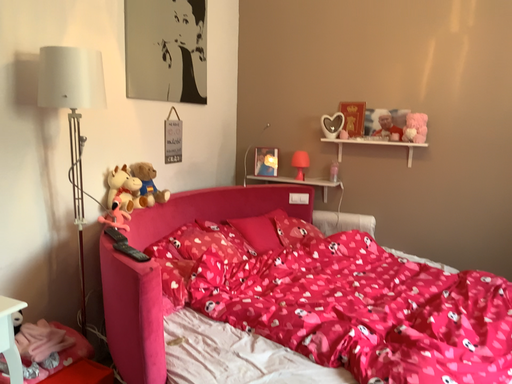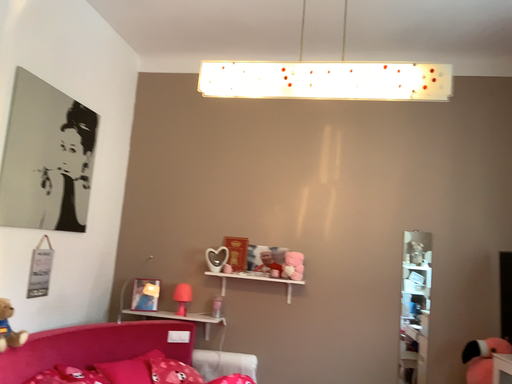
Question: How did the camera likely rotate when shooting the video?

Choices:
 (A) rotated upward
 (B) rotated downward

Answer: (A)